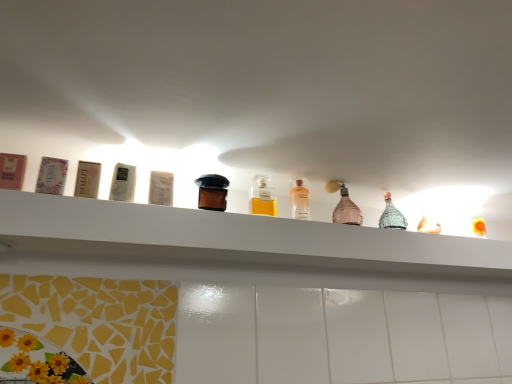
Question: From a real-world perspective, does white glossy shelf at upper center stand above yellow glass bottle at center, placed as the second bottle when sorted from left to right?

Choices:
 (A) no
 (B) yes

Answer: (A)

Question: Is white glossy shelf at upper center at the right side of yellow glass bottle at center, which is the 3th bottle from right to left?

Choices:
 (A) no
 (B) yes

Answer: (B)

Question: From a real-world perspective, does white glossy shelf at upper center sit lower than yellow glass bottle at center, which is the 3th bottle from right to left?

Choices:
 (A) no
 (B) yes

Answer: (B)

Question: From the image's perspective, is white glossy shelf at upper center on yellow glass bottle at center, placed as the second bottle when sorted from left to right?

Choices:
 (A) no
 (B) yes

Answer: (A)

Question: Does white glossy shelf at upper center contain yellow glass bottle at center, which is the 3th bottle from right to left?

Choices:
 (A) no
 (B) yes

Answer: (A)

Question: Considering the positions of white glossy shelf at upper center and pink matte bottle at center, placed as the fourth bottle when sorted from left to right, in the image, is white glossy shelf at upper center bigger or smaller than pink matte bottle at center, placed as the fourth bottle when sorted from left to right,?

Choices:
 (A) big
 (B) small

Answer: (A)

Question: Considering the relative positions of white glossy shelf at upper center and pink matte bottle at center, the 1th bottle when ordered from right to left, in the image provided, is white glossy shelf at upper center to the left or to the right of pink matte bottle at center, the 1th bottle when ordered from right to left,?

Choices:
 (A) left
 (B) right

Answer: (A)

Question: Is white glossy shelf at upper center inside the boundaries of pink matte bottle at center, placed as the fourth bottle when sorted from left to right, or outside?

Choices:
 (A) inside
 (B) outside

Answer: (B)

Question: In the image, is white glossy shelf at upper center positioned in front of or behind pink matte bottle at center, placed as the fourth bottle when sorted from left to right?

Choices:
 (A) behind
 (B) front

Answer: (B)

Question: Considering the positions of point (214, 198) and point (304, 201), is point (214, 198) closer or farther from the camera than point (304, 201)?

Choices:
 (A) farther
 (B) closer

Answer: (B)

Question: From their relative heights in the image, would you say brown glass bottle at center, the 4th bottle viewed from the right, is taller or shorter than clear glass bottle at center, positioned as the 3th bottle in left-to-right order?

Choices:
 (A) short
 (B) tall

Answer: (A)

Question: Is brown glass bottle at center, the 4th bottle viewed from the right, to the left or to the right of clear glass bottle at center, placed as the second bottle when sorted from right to left, in the image?

Choices:
 (A) left
 (B) right

Answer: (A)

Question: Considering their positions, is brown glass bottle at center, the 4th bottle viewed from the right, located in front of or behind clear glass bottle at center, positioned as the 3th bottle in left-to-right order?

Choices:
 (A) behind
 (B) front

Answer: (B)

Question: Relative to yellow glass bottle at center, placed as the second bottle when sorted from left to right, is brown glass bottle at center, placed as the first bottle when sorted from left to right, in front or behind?

Choices:
 (A) behind
 (B) front

Answer: (B)

Question: Is brown glass bottle at center, the 4th bottle viewed from the right, spatially inside yellow glass bottle at center, placed as the second bottle when sorted from left to right, or outside of it?

Choices:
 (A) inside
 (B) outside

Answer: (B)